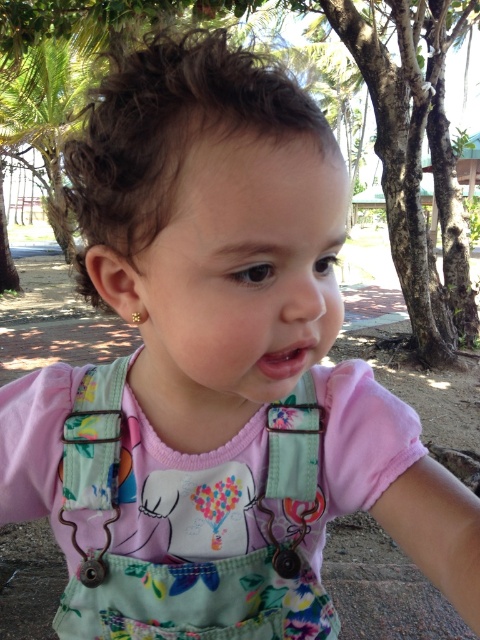
Question: Does metallic fabric strap at lower left have a smaller size compared to floral fabric strap at center?

Choices:
 (A) yes
 (B) no

Answer: (B)

Question: Which point appears farthest from the camera in this image?

Choices:
 (A) (296, 486)
 (B) (111, 490)

Answer: (A)

Question: In this image, where is floral fabric overalls at center located relative to metallic fabric strap at lower left?

Choices:
 (A) right
 (B) left

Answer: (A)

Question: Among these points, which one is farthest from the camera?

Choices:
 (A) (120, 401)
 (B) (178, 572)

Answer: (A)

Question: Does floral fabric overalls at center appear on the right side of metallic fabric strap at lower left?

Choices:
 (A) yes
 (B) no

Answer: (A)

Question: Which object appears closest to the camera in this image?

Choices:
 (A) floral fabric overalls at center
 (B) metallic fabric strap at lower left

Answer: (A)